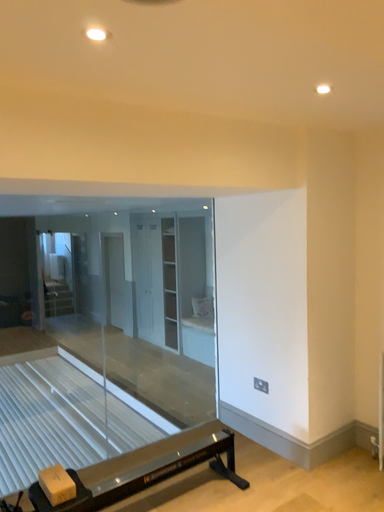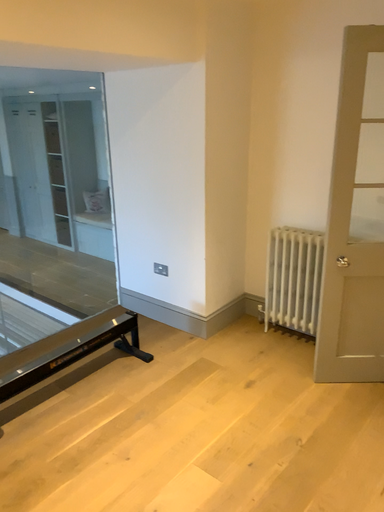
Question: How did the camera likely rotate when shooting the video?

Choices:
 (A) rotated left
 (B) rotated right

Answer: (B)